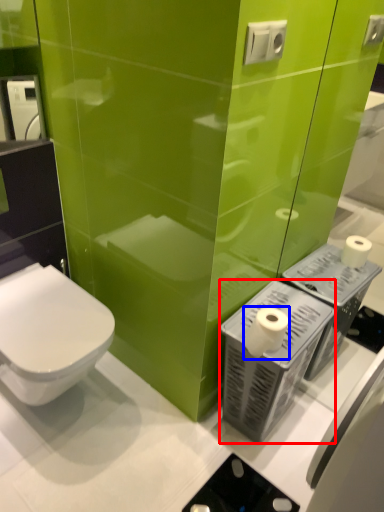
Question: Which object is closer to the camera taking this photo, appliance (highlighted by a red box) or toilet paper (highlighted by a blue box)?

Choices:
 (A) appliance
 (B) toilet paper

Answer: (B)